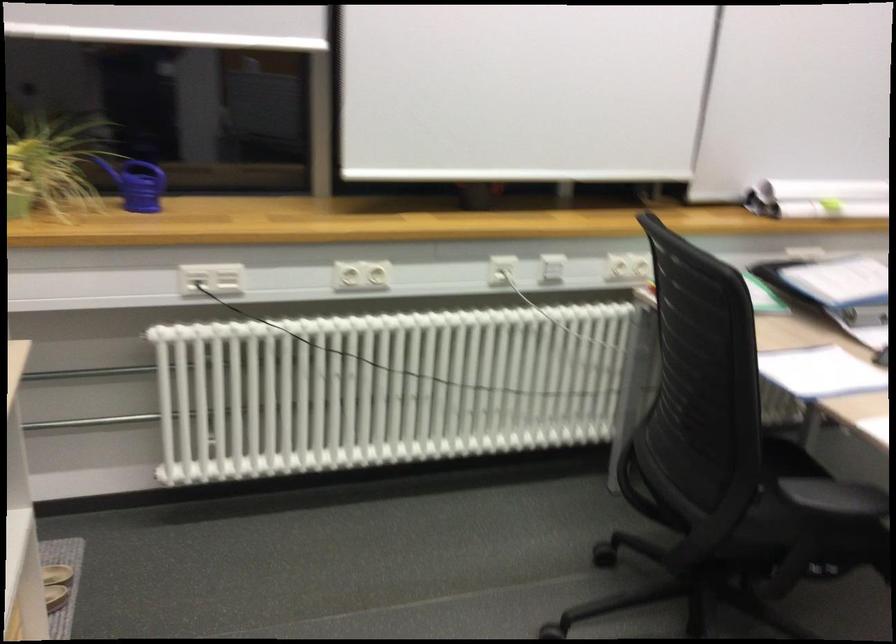
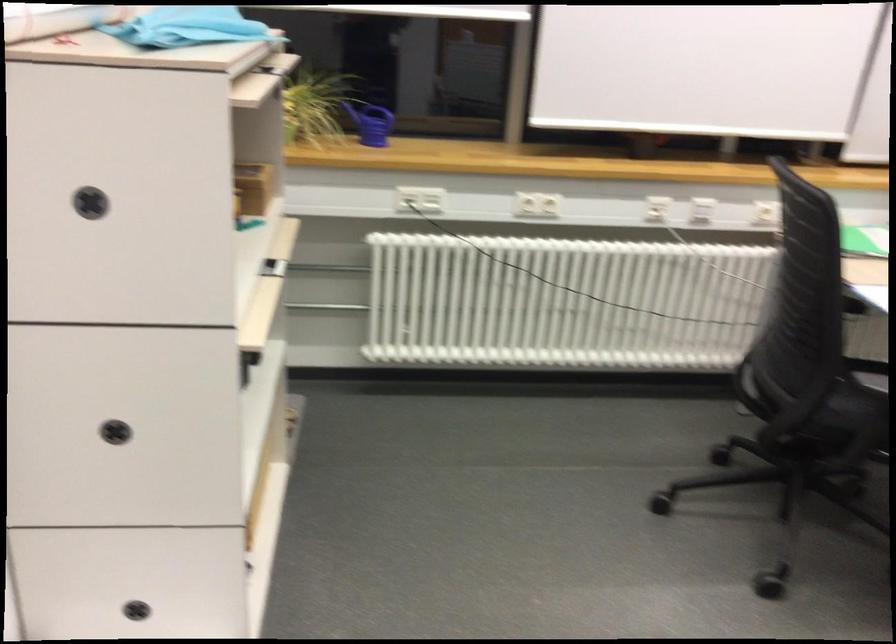
Find the pixel in the second image that matches (x=212, y=283) in the first image.

(419, 199)